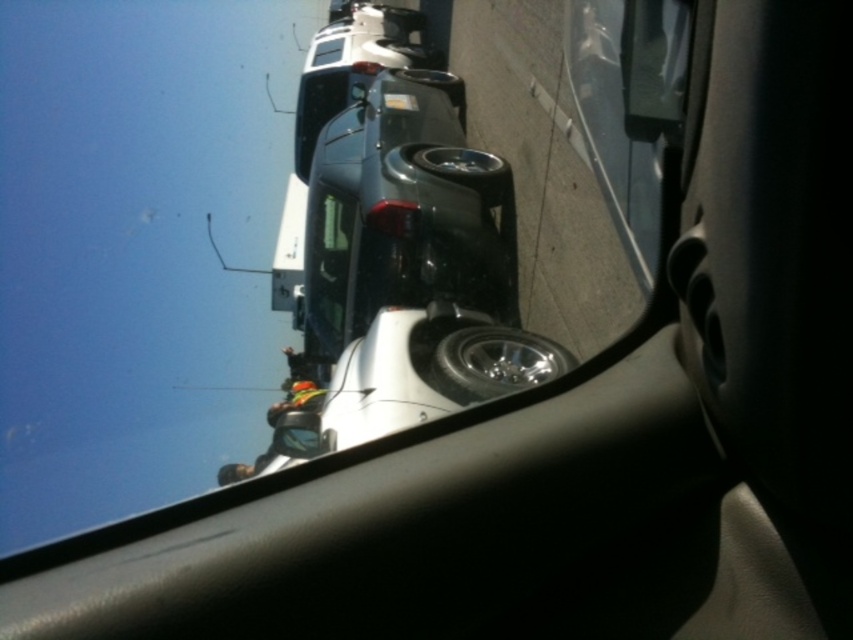
You are driving and want to check your surroundings through the windshield. Which object is closer to you between the glossy black car at center and the glossy plastic car mirror at upper center?

The glossy black car at center is closer to you than the glossy plastic car mirror at upper center.

You are sitting in the driver seat of the vehicle and want to see where the glossy black car at center is located. Based on the coordinates provided, can you determine its position relative to the center of the image?

The glossy black car at center is located at coordinates point (x=403, y=214), which is slightly to the left and below the center of the image.

You are a delivery driver who needs to safely navigate your vehicle through the space between the glossy black car at center and the glossy plastic car mirror at upper center. Your delivery van is 3 meters wide. Can you fit through this space?

The distance between the glossy black car at center and the glossy plastic car mirror at upper center is 3.28 meters. Since your van is 3 meters wide, it can fit through the space as there is enough width available.